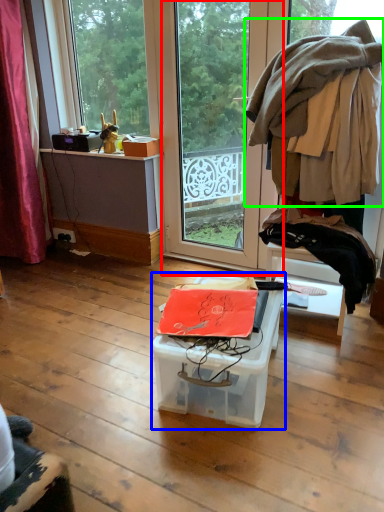
Question: Which object is the closest to the screen door (highlighted by a red box)? Choose among these: box (highlighted by a blue box) or clothing (highlighted by a green box).

Choices:
 (A) box
 (B) clothing

Answer: (B)